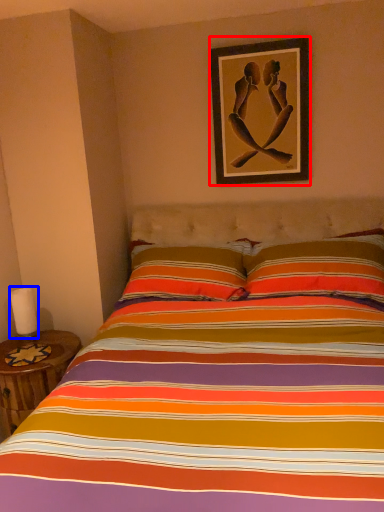
Question: Which point is closer to the camera, picture frame (highlighted by a red box) or candle (highlighted by a blue box)?

Choices:
 (A) picture frame
 (B) candle

Answer: (B)